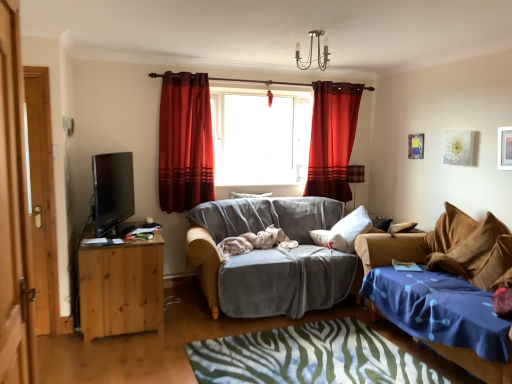
Question: From the image's perspective, is transparent glass window at center located beneath satin red curtain at center, which is the second curtain from left to right?

Choices:
 (A) yes
 (B) no

Answer: (B)

Question: From a real-world perspective, is transparent glass window at center positioned over satin red curtain at center, the 1th curtain in the right-to-left sequence, based on gravity?

Choices:
 (A) yes
 (B) no

Answer: (A)

Question: Considering the relative sizes of transparent glass window at center and satin red curtain at center, the 2th curtain viewed from the front, in the image provided, is transparent glass window at center taller than satin red curtain at center, the 2th curtain viewed from the front,?

Choices:
 (A) no
 (B) yes

Answer: (A)

Question: Is transparent glass window at center to the right of satin red curtain at center, which is the second curtain from left to right, from the viewer's perspective?

Choices:
 (A) yes
 (B) no

Answer: (B)

Question: Considering the relative sizes of transparent glass window at center and satin red curtain at center, which is the second curtain from left to right, in the image provided, is transparent glass window at center bigger than satin red curtain at center, which is the second curtain from left to right,?

Choices:
 (A) yes
 (B) no

Answer: (A)

Question: In terms of height, does velvet deep red curtain at center, the 2th curtain positioned from the right, look taller or shorter compared to metallic chandelier at upper center, which is the 2th lamp from bottom to top?

Choices:
 (A) tall
 (B) short

Answer: (A)

Question: Is velvet deep red curtain at center, positioned as the second curtain in back-to-front order, inside the boundaries of metallic chandelier at upper center, which ranks as the 1th lamp in front-to-back order, or outside?

Choices:
 (A) outside
 (B) inside

Answer: (A)

Question: In terms of width, does velvet deep red curtain at center, the 2th curtain positioned from the right, look wider or thinner when compared to metallic chandelier at upper center, which is the 2th lamp from right to left?

Choices:
 (A) thin
 (B) wide

Answer: (A)

Question: Relative to metallic chandelier at upper center, acting as the first lamp starting from the top, is velvet deep red curtain at center, marked as the first curtain in a left-to-right arrangement, in front or behind?

Choices:
 (A) behind
 (B) front

Answer: (A)

Question: From a real-world perspective, is pine wood desk at left physically located above or below wooden door at left, which is the 2th door in back-to-front order?

Choices:
 (A) below
 (B) above

Answer: (A)

Question: Does point (118, 244) appear closer or farther from the camera than point (7, 342)?

Choices:
 (A) farther
 (B) closer

Answer: (A)

Question: Looking at their shapes, would you say pine wood desk at left is wider or thinner than wooden door at left, arranged as the second door when viewed from the left?

Choices:
 (A) thin
 (B) wide

Answer: (B)

Question: Looking at the image, does pine wood desk at left seem bigger or smaller compared to wooden door at left, arranged as the second door when viewed from the left?

Choices:
 (A) small
 (B) big

Answer: (B)

Question: Considering the positions of point (460, 216) and point (343, 144), is point (460, 216) closer or farther from the camera than point (343, 144)?

Choices:
 (A) farther
 (B) closer

Answer: (B)

Question: Is velvet blue studio couch at lower right, acting as the 2th studio couch starting from the left, inside the boundaries of satin red curtain at center, acting as the 1th curtain starting from the back, or outside?

Choices:
 (A) inside
 (B) outside

Answer: (B)